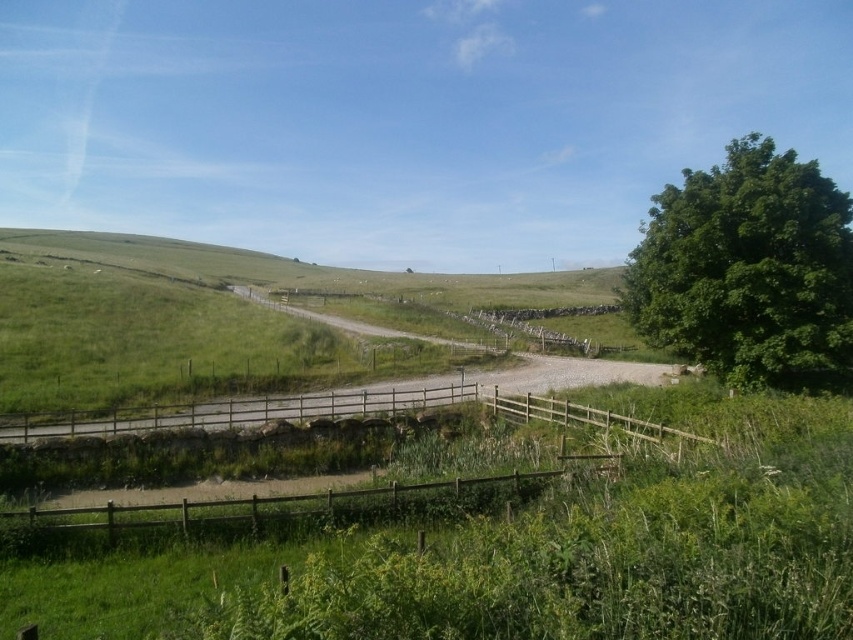
You are standing on the gravel road in the middle of the scene. You want to walk towards the green leafy tree at right and the brown wooden fence at lower center. Which object will you reach first?

You will reach the brown wooden fence at lower center first because it is closer to you than the green leafy tree at right, which is further away.